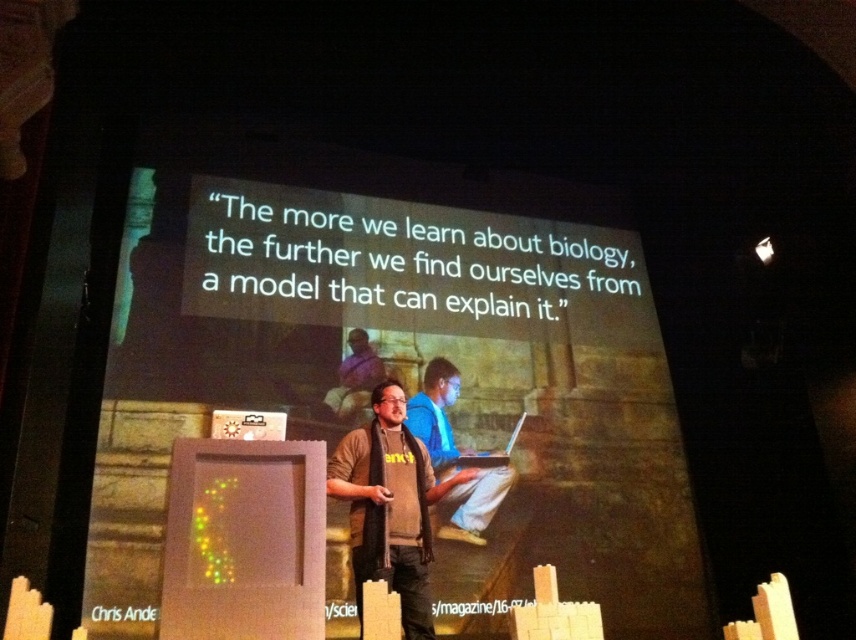
You are attending a presentation and notice a point at coordinates (437,417) on the image. What object is located at this point?

The point at coordinates (437,417) marks the blue cotton shirt at center.

You are a photographer setting up for a presentation. You want to ensure that both the blue cotton shirt at center and the matte silver laptop at center are clearly visible in your photo. Given that your camera has a depth of field that can sharply focus on objects within a 10 inch range, will both items be in focus?

The blue cotton shirt at center and the matte silver laptop at center are 10.21 inches apart. Since the distance between them exceeds the camera sensor depth of field range of 10 inches, both items may not be in focus simultaneously.

You are an attendee at this presentation. You notice the speaker is wearing a blue cotton shirt at center and there is a matte silver laptop at center on the podium. Which object is taller?

The blue cotton shirt at center is much taller than the matte silver laptop at center.